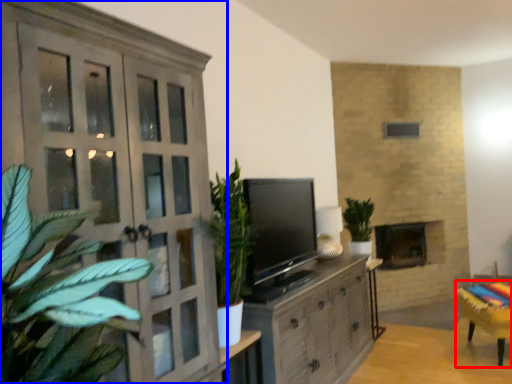
Question: Which of the following is the farthest to the observer, furniture (highlighted by a red box) or cupboard (highlighted by a blue box)?

Choices:
 (A) furniture
 (B) cupboard

Answer: (A)